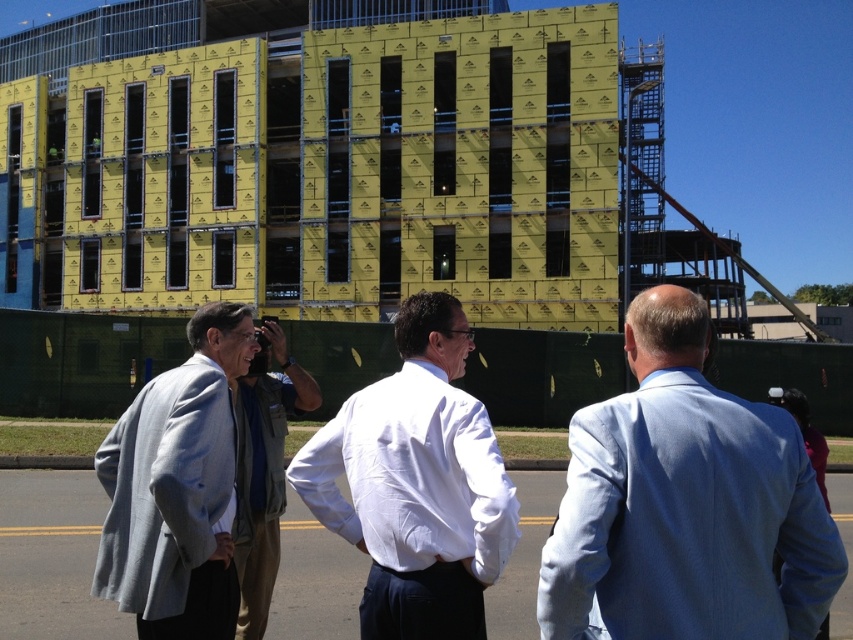
You are standing at the point marked by the coordinates point (685, 504) in the construction site image. Looking around, you see three men. Which man is directly in front of you?

The point (685, 504) indicates the light blue suit at center, so the man in the light blue suit at center is directly in front of you.

You are a photographer taking a picture of the construction site. You want to ensure that both the light blue suit at center and the white smooth shirt at center are fully visible in the frame. Which of the two should you focus on adjusting the camera angle to include in the frame first?

The light blue suit at center is shorter than the white smooth shirt at center, so you should focus on adjusting the camera angle to include the light blue suit at center first to ensure it is fully visible.